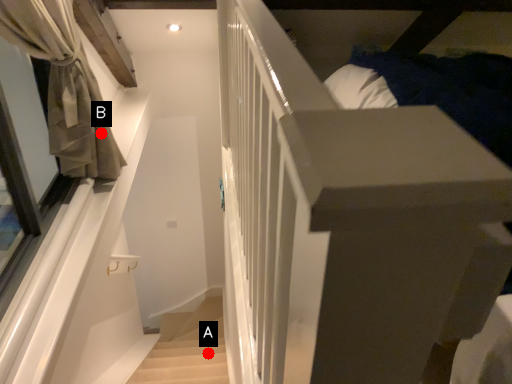
Question: Two points are circled on the image, labeled by A and B beside each circle. Which point is farther from the camera taking this photo?

Choices:
 (A) A is further
 (B) B is further

Answer: (A)